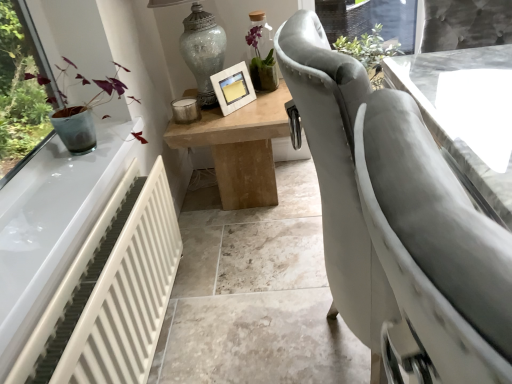
Question: In terms of size, does white glossy table at center, positioned as the 2th table in left-to-right order, appear bigger or smaller than light brown wooden table at center, placed as the 2th table when sorted from right to left?

Choices:
 (A) big
 (B) small

Answer: (A)

Question: Visually, is white glossy table at center, positioned as the 2th table in left-to-right order, positioned to the left or to the right of light brown wooden table at center, which is the first table from left to right?

Choices:
 (A) left
 (B) right

Answer: (B)

Question: Estimate the real-world distances between objects in this image. Which object is closer to the white glossy table at center, positioned as the 2th table in left-to-right order?

Choices:
 (A) white textured picture frame at center
 (B) crackle glass vase at upper center
 (C) light brown wooden table at center, placed as the 2th table when sorted from right to left
 (D) white matte radiator at lower left

Answer: (C)

Question: Which is farther from the white glossy table at center, arranged as the first table when viewed from the right?

Choices:
 (A) light brown wooden table at center, which is the first table from left to right
 (B) white matte radiator at lower left
 (C) white textured picture frame at center
 (D) crackle glass vase at upper center

Answer: (B)